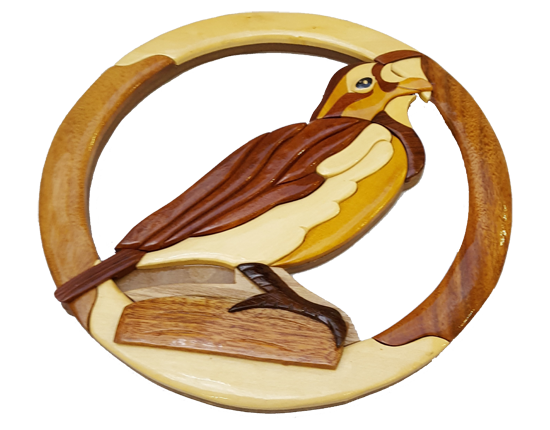
Where is `bird decoration`? This screenshot has width=550, height=430. bird decoration is located at coordinates (293, 184).